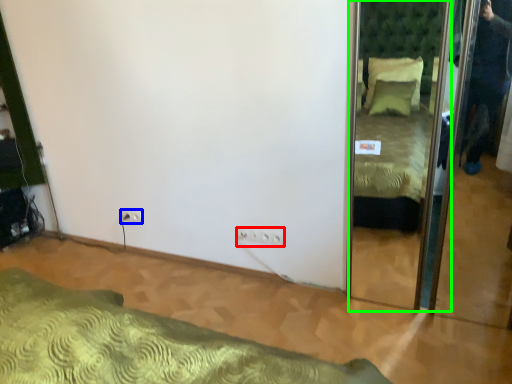
Question: Considering the real-world distances, which object is farthest from electric outlet (highlighted by a red box)? electric outlet (highlighted by a blue box) or mirror (highlighted by a green box)?

Choices:
 (A) electric outlet
 (B) mirror

Answer: (B)